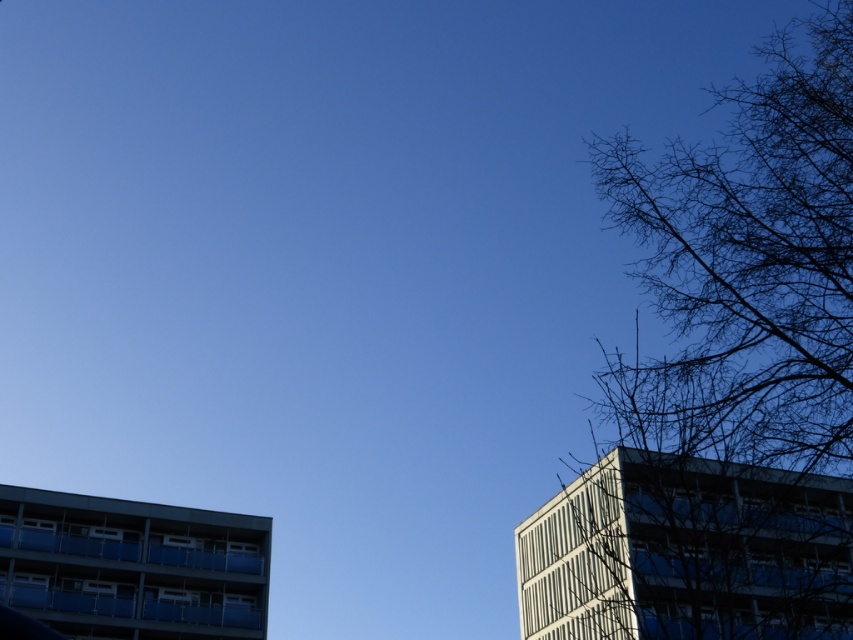
Question: Which point is closer to the camera?

Choices:
 (A) [x=199, y=600]
 (B) [x=566, y=528]
 (C) [x=635, y=218]

Answer: (C)

Question: Based on their relative distances, which object is nearer to the bare branches at right?

Choices:
 (A) white glass building at right
 (B) blue glass balcony at lower left

Answer: (A)

Question: Is bare branches at right to the right of blue glass balcony at lower left from the viewer's perspective?

Choices:
 (A) no
 (B) yes

Answer: (B)

Question: Where is bare branches at right located in relation to blue glass balcony at lower left in the image?

Choices:
 (A) above
 (B) below

Answer: (A)

Question: Is bare branches at right thinner than blue glass balcony at lower left?

Choices:
 (A) no
 (B) yes

Answer: (A)

Question: Estimate the real-world distances between objects in this image. Which object is farther from the white glass building at right?

Choices:
 (A) bare branches at right
 (B) blue glass balcony at lower left

Answer: (B)